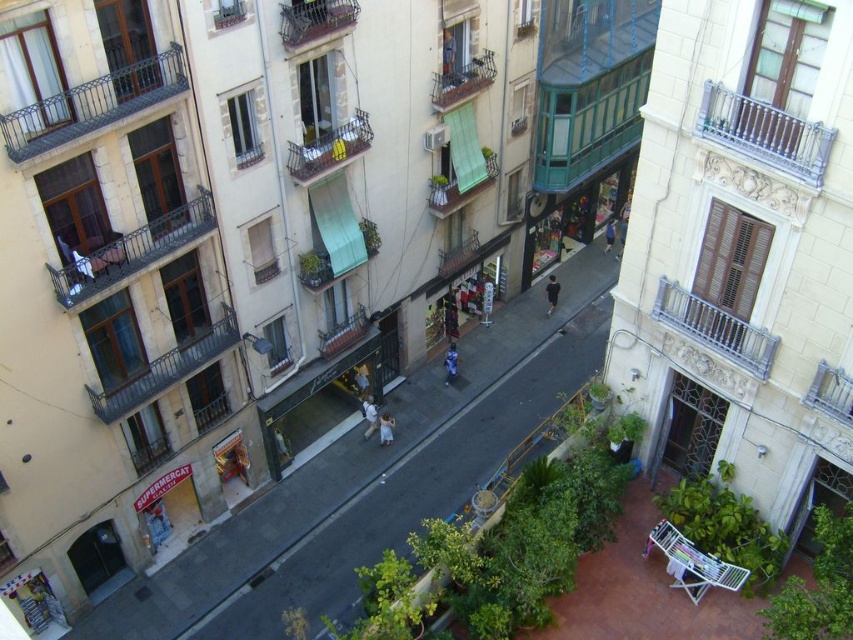
Question: Which point is farther to the camera?

Choices:
 (A) light blue jeans at lower left
 (B) light blue denim jeans at center

Answer: (B)

Question: Estimate the real-world distances between objects in this image. Which object is closer to the metallic silver balcony at right?

Choices:
 (A) metallic silver balcony at upper right
 (B) black fabric person at center
 (C) wooden brown balcony at left

Answer: (A)

Question: Considering the relative positions of wooden brown balcony at left and green fabric awning at center in the image provided, where is wooden brown balcony at left located with respect to green fabric awning at center?

Choices:
 (A) below
 (B) above

Answer: (A)

Question: Can you confirm if metallic gray balcony at upper center is positioned to the left of metallic silver balcony at upper right?

Choices:
 (A) no
 (B) yes

Answer: (B)

Question: Does metallic gray balcony at center have a larger size compared to light blue jeans at lower left?

Choices:
 (A) no
 (B) yes

Answer: (B)

Question: Estimate the real-world distances between objects in this image. Which object is closer to the green fabric curtain at center?

Choices:
 (A) metallic silver balcony at right
 (B) metallic balcony at upper center
 (C) wooden brown balcony at left

Answer: (B)